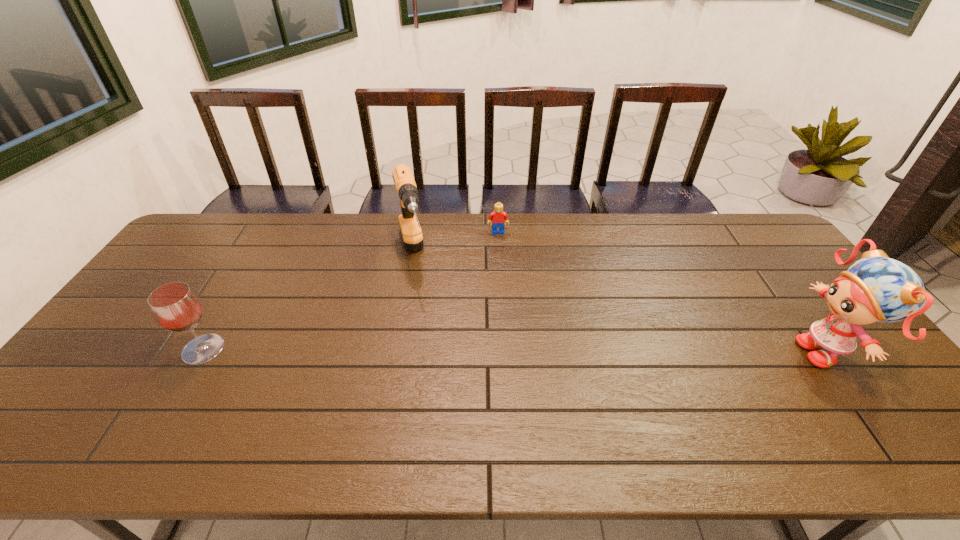
At what (x,y) coordinates should I click in order to perform the action: click on free point located on the face of the third object from left to right. Please return your answer as a coordinate pair (x, y). The image size is (960, 540). Looking at the image, I should click on (502, 308).

Locate an element on the screen. This screenshot has height=540, width=960. free space located 0.120m at the tip of the second object from left to right is located at coordinates (420, 312).

Identify the location of vacant space located at the tip of the second object from left to right. (435, 370).

The height and width of the screenshot is (540, 960). I want to click on vacant region located 0.300m at the tip of the second object from left to right, so click(432, 361).

The height and width of the screenshot is (540, 960). I want to click on Lego present at the far edge, so click(x=498, y=216).

Where is `drill present at the far edge`? This screenshot has width=960, height=540. drill present at the far edge is located at coordinates (411, 232).

At what (x,y) coordinates should I click in order to perform the action: click on object that is at the near edge. Please return your answer as a coordinate pair (x, y). This screenshot has height=540, width=960. Looking at the image, I should click on (876, 288).

Find the location of a particular element. This screenshot has width=960, height=540. object that is at the right edge is located at coordinates (876, 288).

Locate an element on the screen. Image resolution: width=960 pixels, height=540 pixels. object located at the near right corner is located at coordinates (876, 288).

At what (x,y) coordinates should I click in order to perform the action: click on free spot at the far edge of the desktop. Please return your answer as a coordinate pair (x, y). Looking at the image, I should click on (718, 249).